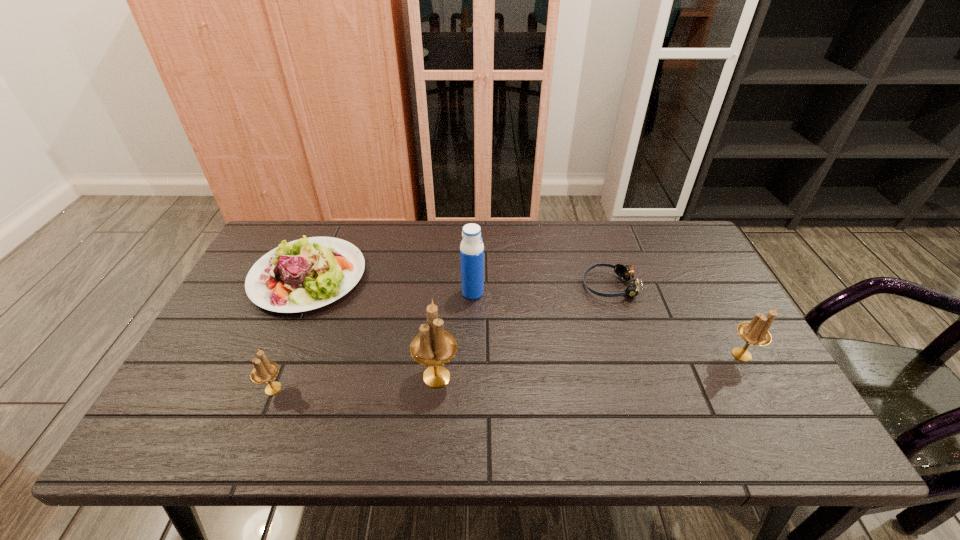
Find the location of a particular element. Image resolution: width=960 pixels, height=540 pixels. vacant space that's between the salad plate and the shortest object is located at coordinates (459, 281).

This screenshot has height=540, width=960. Find the location of `vacant area between the third shortest object and the salad plate`. vacant area between the third shortest object and the salad plate is located at coordinates (291, 333).

You are a GUI agent. You are given a task and a screenshot of the screen. Output one action in this format:
    pyautogui.click(x=<x>, y=<y>)
    Task: Click on the vacant region between the shortest object and the second candle holder from left to right
    The width and height of the screenshot is (960, 540).
    Given the screenshot: What is the action you would take?
    tap(523, 331)

You are a GUI agent. You are given a task and a screenshot of the screen. Output one action in this format:
    pyautogui.click(x=<x>, y=<y>)
    Task: Click on the empty space that is in between the second tallest candle holder and the fourth tallest object
    The image size is (960, 540).
    Given the screenshot: What is the action you would take?
    pyautogui.click(x=508, y=372)

Select which object is the third closest to the shortest candle holder. Please provide its 2D coordinates. Your answer should be formatted as a tuple, i.e. [(x, y)], where the tuple contains the x and y coordinates of a point satisfying the conditions above.

[(471, 248)]

Choose which object is the nearest neighbor to the water bottle. Please provide its 2D coordinates. Your answer should be formatted as a tuple, i.e. [(x, y)], where the tuple contains the x and y coordinates of a point satisfying the conditions above.

[(433, 346)]

The height and width of the screenshot is (540, 960). I want to click on candle holder that is the second nearest to the fourth shortest object, so click(264, 371).

You are a GUI agent. You are given a task and a screenshot of the screen. Output one action in this format:
    pyautogui.click(x=<x>, y=<y>)
    Task: Click on the closest candle holder relative to the fifth tallest object
    The image size is (960, 540).
    Given the screenshot: What is the action you would take?
    pyautogui.click(x=264, y=371)

At what (x,y) coordinates should I click in order to perform the action: click on free region that satisfies the following two spatial constraints: 1. through the lenses of the shortest object; 2. on the left side of the rightmost object. Please return your answer as a coordinate pair (x, y). The height and width of the screenshot is (540, 960). Looking at the image, I should click on (632, 354).

In order to click on free space that satisfies the following two spatial constraints: 1. on the back side of the shortest candle holder; 2. on the left side of the second candle holder from left to right in this screenshot , I will do `click(278, 377)`.